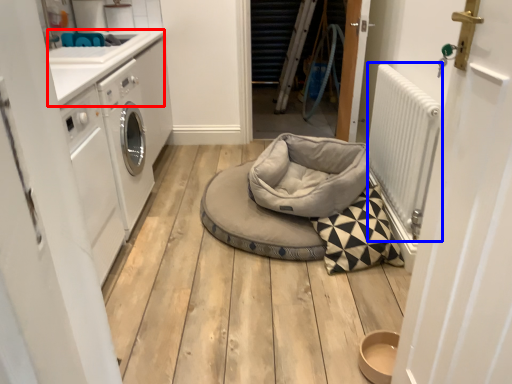
Question: Which of the following is the farthest to the observer, counter top (highlighted by a red box) or radiator (highlighted by a blue box)?

Choices:
 (A) counter top
 (B) radiator

Answer: (A)